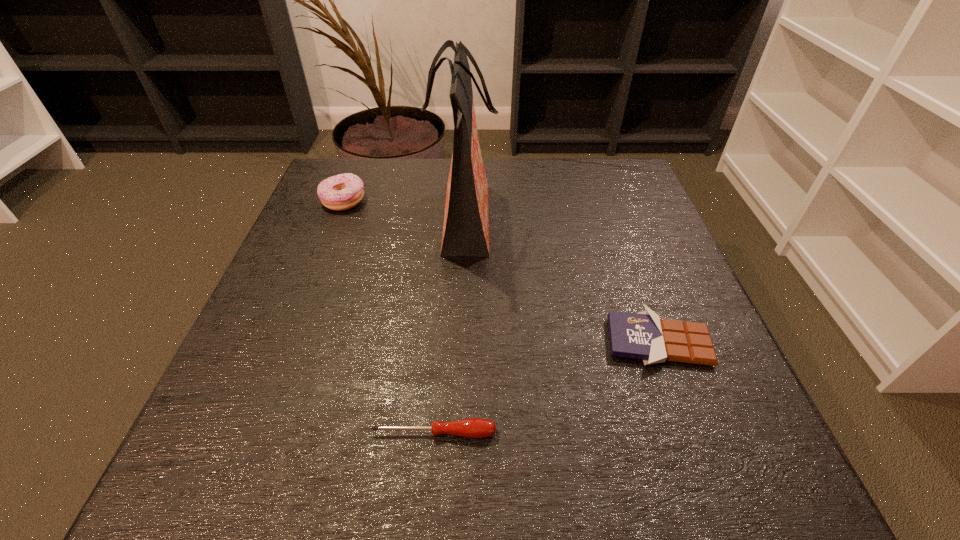
Where is `empty location between the doughnut and the rightmost object`? The image size is (960, 540). empty location between the doughnut and the rightmost object is located at coordinates (501, 271).

At what (x,y) coordinates should I click in order to perform the action: click on free space between the second nearest object and the nearest object. Please return your answer as a coordinate pair (x, y). This screenshot has width=960, height=540. Looking at the image, I should click on (546, 387).

Locate an element on the screen. The width and height of the screenshot is (960, 540). the second closest object relative to the screwdriver is located at coordinates (466, 219).

This screenshot has height=540, width=960. Identify the location of object that stands as the third closest to the screwdriver. (340, 192).

Where is `free space that satisfies the following two spatial constraints: 1. on the front side of the tallest object; 2. on the front side of the screwdriver`? The height and width of the screenshot is (540, 960). free space that satisfies the following two spatial constraints: 1. on the front side of the tallest object; 2. on the front side of the screwdriver is located at coordinates click(x=454, y=433).